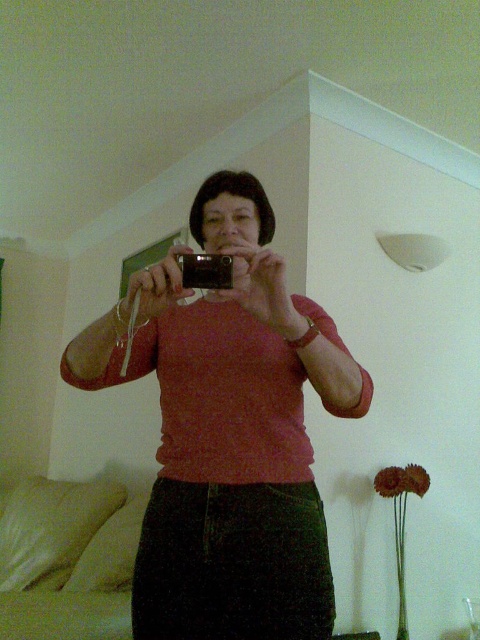
Where is `matte pink sweater at center`? matte pink sweater at center is located at coordinates (228, 433).

Who is more forward, (190, 625) or (204, 272)?

Point (204, 272) is more forward.

This screenshot has width=480, height=640. I want to click on matte pink sweater at center, so click(x=228, y=433).

Identify the location of matte pink sweater at center. (228, 433).